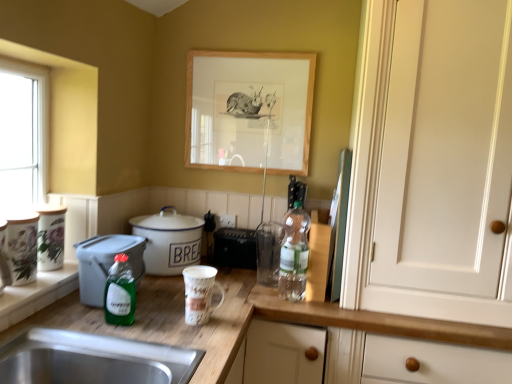
Locate an element on the screen. free space in front of black plastic toaster at center, which is counted as the 3th appliance, starting from the left is located at coordinates (243, 274).